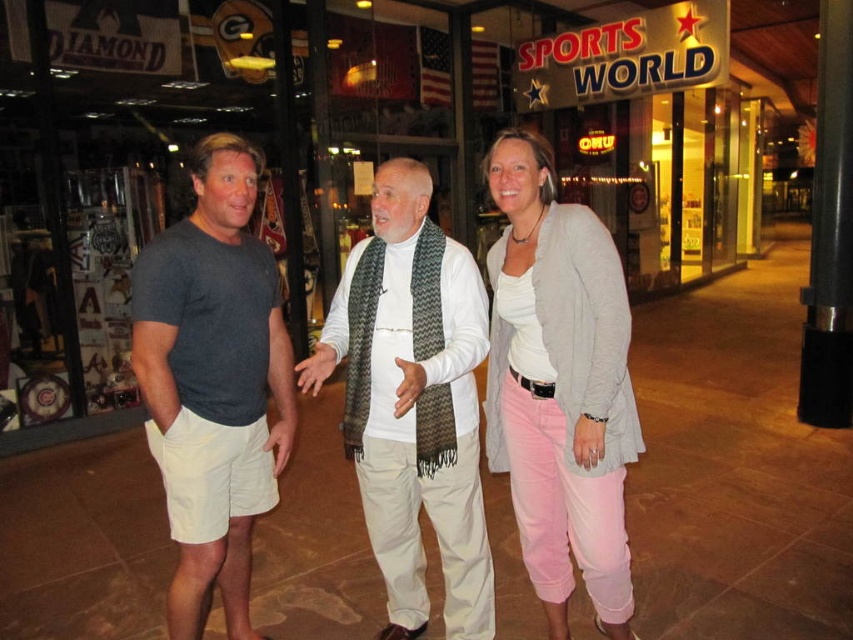
Who is shorter, white woven scarf at center or dark gray t-shirt at left?

white woven scarf at center is shorter.

Between white woven scarf at center and dark gray t-shirt at left, which one has more height?

With more height is dark gray t-shirt at left.

What do you see at coordinates (413, 403) in the screenshot? I see `white woven scarf at center` at bounding box center [413, 403].

This screenshot has height=640, width=853. What are the coordinates of `white woven scarf at center` in the screenshot? It's located at (413, 403).

This screenshot has height=640, width=853. In order to click on gray cotton cardigan at center in this screenshot , I will do `click(561, 392)`.

Does gray cotton cardigan at center have a greater width compared to white woven scarf at center?

Indeed, gray cotton cardigan at center has a greater width compared to white woven scarf at center.

Locate an element on the screen. gray cotton cardigan at center is located at coordinates (561, 392).

Does gray cotton cardigan at center appear over light gray textured cardigan at center?

No.

Between gray cotton cardigan at center and light gray textured cardigan at center, which one is positioned lower?

gray cotton cardigan at center is lower down.

Does point (473, 346) lie in front of point (546, 282)?

That is False.

What are the coordinates of `gray cotton cardigan at center` in the screenshot? It's located at (561, 392).